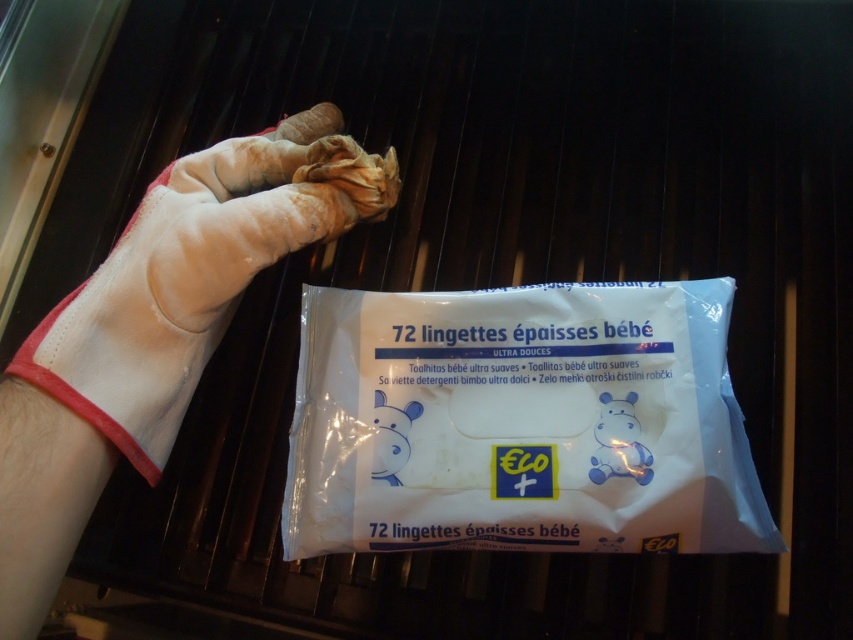
You are a parent trying to reach the white plastic wipes at center while holding a white leather glove at upper left. Can you grab the wipes without moving your hand?

The white plastic wipes at center is 5.49 inches away from the white leather glove at upper left. Since the distance is more than the typical hand length, you can grab the wipes without moving your hand.

You are a parent trying to clean your baby. You have a white plastic wipes at center and a white leather glove at upper left. Which item is wider?

The white plastic wipes at center is wider than the white leather glove at upper left.

You are holding a camera and want to take a closeup photo of the white plastic wipes at center. The camera has a minimum focusing distance of 12 inches. Can you take the photo without moving the camera or the wipes?

The white plastic wipes at center and camera are 17.18 inches apart. Since the minimum focusing distance is 12 inches, the camera can focus on the white plastic wipes at center as 17.18 inches is greater than 12 inches. Therefore, you can take the closeup photo without moving either.